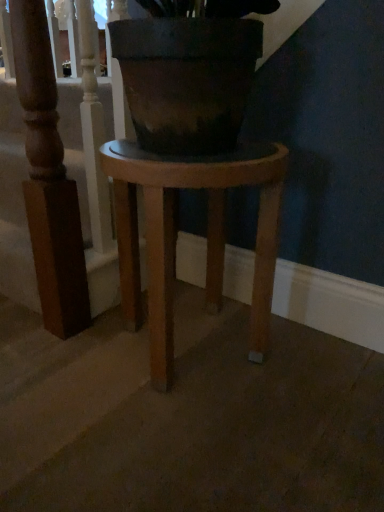
Where is `free space in front of wooden stool at center`? This screenshot has height=512, width=384. free space in front of wooden stool at center is located at coordinates (185, 443).